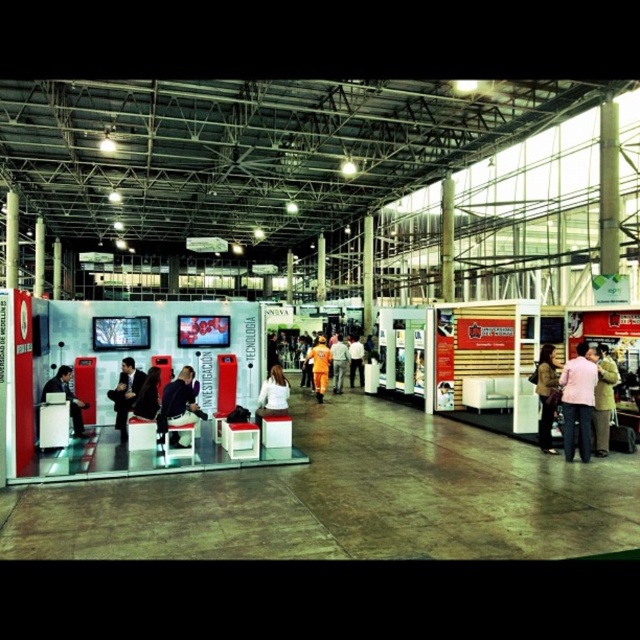
Question: Which point appears farthest from the camera in this image?

Choices:
 (A) (125, 413)
 (B) (314, 385)
 (C) (61, 392)

Answer: (B)

Question: Which object is positioned farthest from the orange uniform at center?

Choices:
 (A) matte black laptop at left
 (B) white matte shirt at center
 (C) light pink fabric coat at right

Answer: (A)

Question: Which point is closer to the camera taking this photo?

Choices:
 (A) (173, 426)
 (B) (605, 356)

Answer: (A)

Question: Can you confirm if orange fabric jacket at center is positioned below orange uniform at center?

Choices:
 (A) yes
 (B) no

Answer: (B)

Question: Is the position of pink fabric jacket at right less distant than that of brown leather jacket at lower right?

Choices:
 (A) no
 (B) yes

Answer: (B)

Question: Does pink fabric jacket at right have a lesser width compared to matte black jacket at center?

Choices:
 (A) yes
 (B) no

Answer: (A)